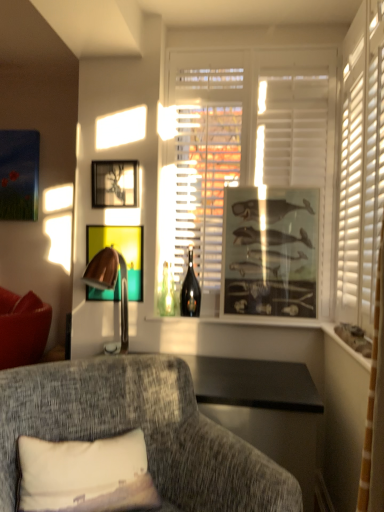
Question: Considering the relative positions of copper metallic table lamp at left and shiny dark glass wine bottle at center in the image provided, is copper metallic table lamp at left to the left of shiny dark glass wine bottle at center from the viewer's perspective?

Choices:
 (A) yes
 (B) no

Answer: (A)

Question: Could you tell me if copper metallic table lamp at left is turned towards shiny dark glass wine bottle at center?

Choices:
 (A) yes
 (B) no

Answer: (B)

Question: Is the position of copper metallic table lamp at left less distant than that of shiny dark glass wine bottle at center?

Choices:
 (A) yes
 (B) no

Answer: (A)

Question: From a real-world perspective, is copper metallic table lamp at left physically below shiny dark glass wine bottle at center?

Choices:
 (A) yes
 (B) no

Answer: (A)

Question: Does copper metallic table lamp at left have a larger size compared to shiny dark glass wine bottle at center?

Choices:
 (A) yes
 (B) no

Answer: (A)

Question: In terms of size, does white matte window at center appear bigger or smaller than white fabric pillow at lower left?

Choices:
 (A) big
 (B) small

Answer: (A)

Question: Is white matte window at center in front of or behind white fabric pillow at lower left in the image?

Choices:
 (A) front
 (B) behind

Answer: (B)

Question: Is white matte window at center inside or outside of white fabric pillow at lower left?

Choices:
 (A) outside
 (B) inside

Answer: (A)

Question: From the image's perspective, relative to white fabric pillow at lower left, is white matte window at center above or below?

Choices:
 (A) above
 (B) below

Answer: (A)

Question: Is textured gray couch at lower left spatially inside clear glass bottles at center, arranged as the second window sill when viewed from the right, or outside of it?

Choices:
 (A) inside
 (B) outside

Answer: (B)

Question: From a real-world perspective, is textured gray couch at lower left physically located above or below clear glass bottles at center, which is counted as the first window sill, starting from the left?

Choices:
 (A) above
 (B) below

Answer: (B)

Question: Based on their sizes in the image, would you say textured gray couch at lower left is bigger or smaller than clear glass bottles at center, marked as the 2th window sill in a front-to-back arrangement?

Choices:
 (A) big
 (B) small

Answer: (A)

Question: Visually, is textured gray couch at lower left positioned to the left or to the right of clear glass bottles at center, which is the 1th window sill from back to front?

Choices:
 (A) left
 (B) right

Answer: (A)

Question: In the image, is metallic gold picture frame at center, acting as the 2th picture frame starting from the right, on the left side or the right side of copper metallic table lamp at left?

Choices:
 (A) right
 (B) left

Answer: (B)

Question: Considering the positions of metallic gold picture frame at center, positioned as the second picture frame in left-to-right order, and copper metallic table lamp at left in the image, is metallic gold picture frame at center, positioned as the second picture frame in left-to-right order, bigger or smaller than copper metallic table lamp at left?

Choices:
 (A) big
 (B) small

Answer: (B)